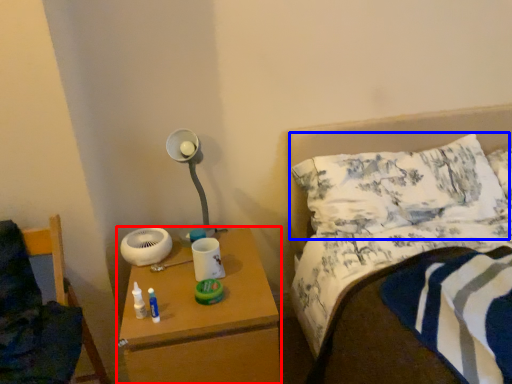
Question: Among these objects, which one is farthest to the camera, nightstand (highlighted by a red box) or pillow (highlighted by a blue box)?

Choices:
 (A) nightstand
 (B) pillow

Answer: (B)